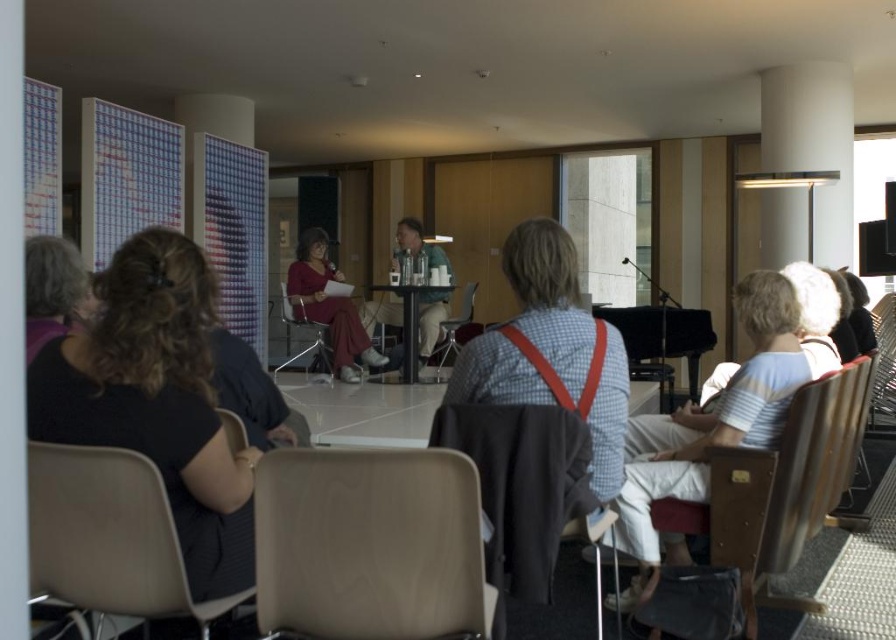
Can you confirm if black fabric shirt at left is positioned above wooden chair at lower right?

Yes, black fabric shirt at left is above wooden chair at lower right.

Who is more distant from viewer, (41, 403) or (799, 403)?

Positioned behind is point (799, 403).

This screenshot has width=896, height=640. Describe the element at coordinates (156, 400) in the screenshot. I see `black fabric shirt at left` at that location.

Where is `black fabric shirt at left`? black fabric shirt at left is located at coordinates (156, 400).

Who is higher up, light brown leather chair at center or wooden chair at lower right?

light brown leather chair at center is higher up.

Can you confirm if light brown leather chair at center is shorter than wooden chair at lower right?

Correct, light brown leather chair at center is not as tall as wooden chair at lower right.

Is point (425, 609) positioned after point (849, 380)?

That is False.

I want to click on light brown leather chair at center, so click(369, 545).

Consider the image. Can you confirm if matte black chair at center is positioned to the right of matte red dress at center?

Yes, matte black chair at center is to the right of matte red dress at center.

Between matte black chair at center and matte red dress at center, which one appears on the left side from the viewer's perspective?

matte red dress at center

Describe the element at coordinates (521, 490) in the screenshot. I see `matte black chair at center` at that location.

Identify the location of matte black chair at center. (521, 490).